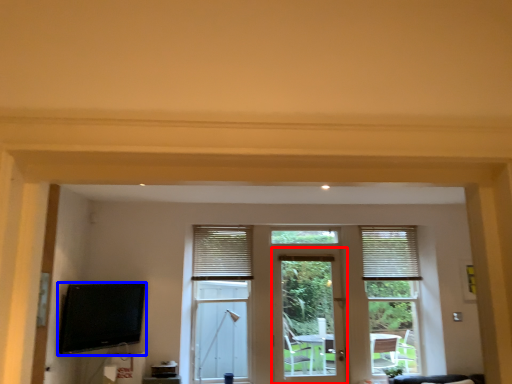
Question: Which object is further to the camera taking this photo, door (highlighted by a red box) or television (highlighted by a blue box)?

Choices:
 (A) door
 (B) television

Answer: (A)